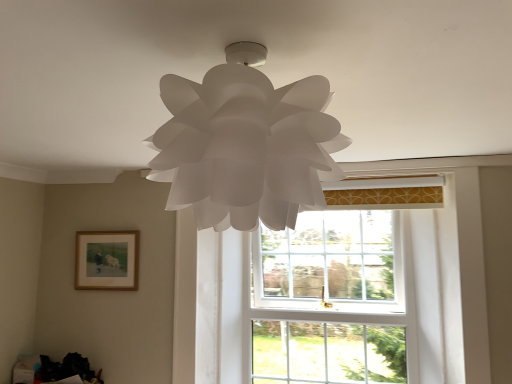
Question: From the image's perspective, is white glass window at center over white paper lamp at center?

Choices:
 (A) no
 (B) yes

Answer: (A)

Question: Is white glass window at center taller than white paper lamp at center?

Choices:
 (A) no
 (B) yes

Answer: (B)

Question: Can you confirm if white glass window at center is wider than white paper lamp at center?

Choices:
 (A) yes
 (B) no

Answer: (B)

Question: From a real-world perspective, does white glass window at center sit lower than white paper lamp at center?

Choices:
 (A) yes
 (B) no

Answer: (A)

Question: Could you tell me if white glass window at center is facing white paper lamp at center?

Choices:
 (A) no
 (B) yes

Answer: (B)

Question: Would you consider white glass window at center to be distant from white paper lamp at center?

Choices:
 (A) yes
 (B) no

Answer: (A)

Question: From the image's perspective, is wooden framed painting at lower left located beneath white glass window at center?

Choices:
 (A) yes
 (B) no

Answer: (B)

Question: Can you see wooden framed painting at lower left touching white glass window at center?

Choices:
 (A) no
 (B) yes

Answer: (A)

Question: Would you say white glass window at center is part of wooden framed painting at lower left's contents?

Choices:
 (A) no
 (B) yes

Answer: (A)

Question: Is wooden framed painting at lower left at the left side of white glass window at center?

Choices:
 (A) yes
 (B) no

Answer: (A)

Question: From a real-world perspective, does wooden framed painting at lower left sit lower than white glass window at center?

Choices:
 (A) yes
 (B) no

Answer: (B)

Question: Is wooden framed painting at lower left aimed at white glass window at center?

Choices:
 (A) yes
 (B) no

Answer: (B)

Question: Considering the relative positions of white paper lamp at center and wooden framed painting at lower left in the image provided, is white paper lamp at center behind wooden framed painting at lower left?

Choices:
 (A) no
 (B) yes

Answer: (A)